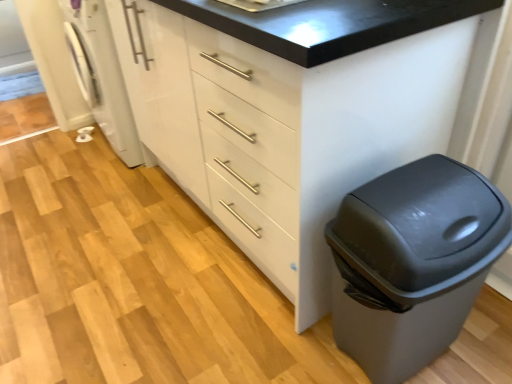
Question: From the image's perspective, does white glossy washing machine at left appear higher than white glossy cabinet at center?

Choices:
 (A) no
 (B) yes

Answer: (B)

Question: Is white glossy washing machine at left not near white glossy cabinet at center?

Choices:
 (A) no
 (B) yes

Answer: (A)

Question: Is white glossy washing machine at left next to white glossy cabinet at center and touching it?

Choices:
 (A) no
 (B) yes

Answer: (A)

Question: Can you confirm if white glossy washing machine at left is wider than white glossy cabinet at center?

Choices:
 (A) yes
 (B) no

Answer: (B)

Question: Does white glossy washing machine at left have a larger size compared to white glossy cabinet at center?

Choices:
 (A) yes
 (B) no

Answer: (B)

Question: Is point (114, 4) positioned closer to the camera than point (458, 223)?

Choices:
 (A) closer
 (B) farther

Answer: (B)

Question: In terms of size, does white glossy cabinet at center appear bigger or smaller than matte gray trash can at lower right?

Choices:
 (A) big
 (B) small

Answer: (A)

Question: In terms of width, does white glossy cabinet at center look wider or thinner when compared to matte gray trash can at lower right?

Choices:
 (A) thin
 (B) wide

Answer: (B)

Question: In terms of height, does white glossy cabinet at center look taller or shorter compared to matte gray trash can at lower right?

Choices:
 (A) tall
 (B) short

Answer: (A)

Question: Looking at their shapes, would you say matte gray trash can at lower right is wider or thinner than white glossy washing machine at left?

Choices:
 (A) thin
 (B) wide

Answer: (A)

Question: Considering the positions of point (435, 339) and point (123, 140), is point (435, 339) closer or farther from the camera than point (123, 140)?

Choices:
 (A) farther
 (B) closer

Answer: (B)

Question: From a real-world perspective, is matte gray trash can at lower right above or below white glossy washing machine at left?

Choices:
 (A) below
 (B) above

Answer: (A)

Question: Is matte gray trash can at lower right bigger or smaller than white glossy washing machine at left?

Choices:
 (A) big
 (B) small

Answer: (B)

Question: From the image's perspective, is white glossy washing machine at left located above or below white glossy cabinet at center?

Choices:
 (A) below
 (B) above

Answer: (B)

Question: Do you think white glossy washing machine at left is within white glossy cabinet at center, or outside of it?

Choices:
 (A) outside
 (B) inside

Answer: (A)